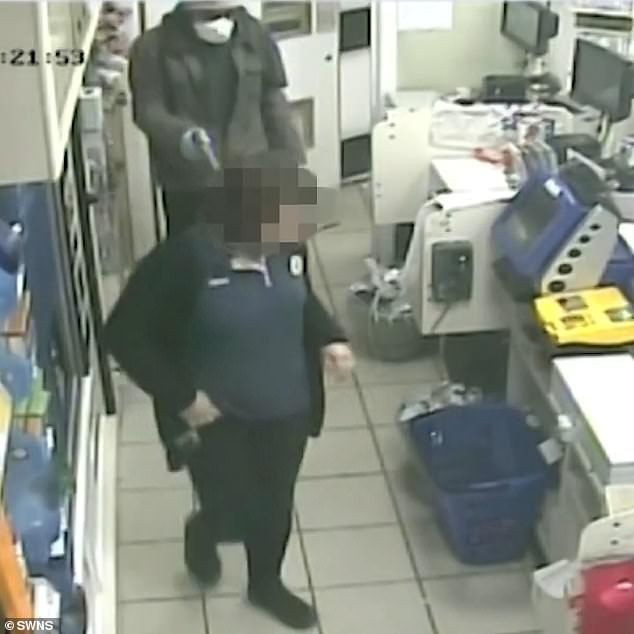
Identify the location of basket. Image resolution: width=634 pixels, height=634 pixels. (480, 501).